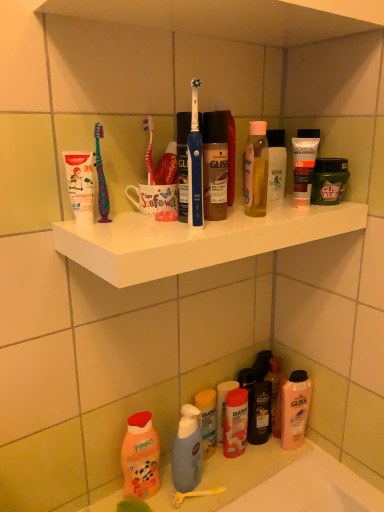
Locate an element on the screen. The width and height of the screenshot is (384, 512). free location to the right of blue plastic toothbrush at center is located at coordinates (257, 221).